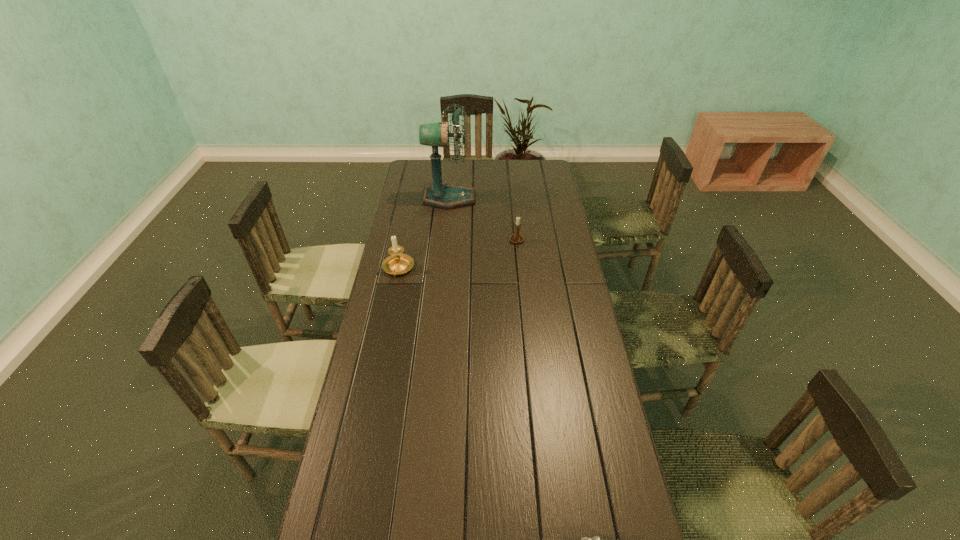
Locate an element on the screen. The image size is (960, 540). fan is located at coordinates (448, 196).

This screenshot has width=960, height=540. In order to click on the farthest object in this screenshot , I will do `click(448, 196)`.

Locate an element on the screen. This screenshot has width=960, height=540. the left candle holder is located at coordinates (398, 263).

Image resolution: width=960 pixels, height=540 pixels. I want to click on the nearer candle holder, so click(398, 263).

Locate an element on the screen. This screenshot has height=540, width=960. the third nearest object is located at coordinates (515, 238).

Locate an element on the screen. This screenshot has height=540, width=960. the farther candle holder is located at coordinates (515, 238).

Where is `free space located in front of the fan where the wind blows`? The height and width of the screenshot is (540, 960). free space located in front of the fan where the wind blows is located at coordinates (486, 199).

Find the location of a particular element. vacant space situated 0.190m with a handle on the side of the second nearest object is located at coordinates (388, 319).

Where is `vacant region located on the side of the second farthest object with the handle`? The height and width of the screenshot is (540, 960). vacant region located on the side of the second farthest object with the handle is located at coordinates (520, 278).

Find the location of `fan at the left edge`. fan at the left edge is located at coordinates (448, 196).